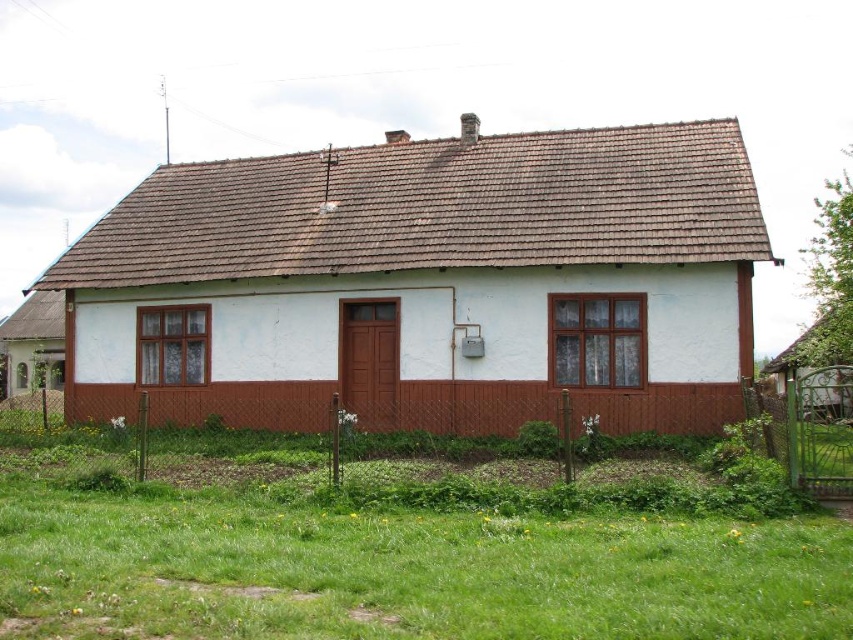
Question: Which of these objects is positioned closest to the green grass at lower center?

Choices:
 (A) white painted wood cottage at lower left
 (B) white painted wood cottage at center

Answer: (B)

Question: Where is white painted wood cottage at center located in relation to green grass at lower center in the image?

Choices:
 (A) above
 (B) below

Answer: (A)

Question: In this image, where is green grass at lower center located relative to white painted wood cottage at lower left?

Choices:
 (A) right
 (B) left

Answer: (A)

Question: Does white painted wood cottage at center have a greater width compared to green grass at lower center?

Choices:
 (A) yes
 (B) no

Answer: (A)

Question: Which of the following is the farthest from the observer?

Choices:
 (A) (36, 342)
 (B) (142, 339)

Answer: (A)

Question: Which point is farther to the camera?

Choices:
 (A) white painted wood cottage at center
 (B) white painted wood cottage at lower left

Answer: (B)